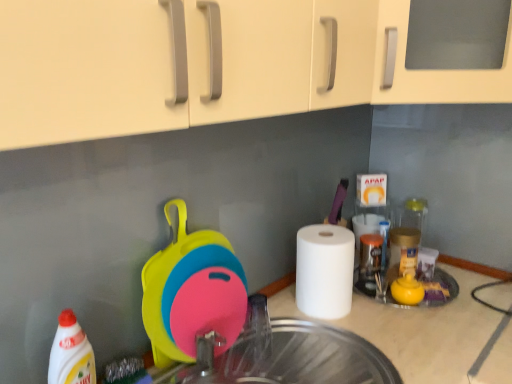
The image size is (512, 384). I want to click on white glossy bottle at lower left, so click(71, 353).

Measure the distance between silicone cutting board at center and camera.

The distance of silicone cutting board at center from camera is 37.70 inches.

Find the location of a particular element. transparent glass sink at center is located at coordinates (298, 359).

The image size is (512, 384). Identify the location of white glossy bottle at lower left. pos(71,353).

Can you tell me how much white matte paper towel at right and transparent glass sink at center differ in facing direction?

The angular difference between white matte paper towel at right and transparent glass sink at center is 1.01 degrees.

From the image's perspective, is white matte paper towel at right located above or below transparent glass sink at center?

Clearly, from the image's perspective, white matte paper towel at right is above transparent glass sink at center.

Is white matte paper towel at right not near transparent glass sink at center?

No, white matte paper towel at right is in close proximity to transparent glass sink at center.

Which is closer to the camera, (305, 313) or (305, 369)?

The point (305, 369) is closer to the camera.

In the scene shown: Is white matte paper towel at right taller than silicone cutting board at center?

Incorrect, the height of white matte paper towel at right is not larger of that of silicone cutting board at center.

Looking at this image, is the depth of white matte paper towel at right greater than that of silicone cutting board at center?

Yes, white matte paper towel at right is further from the viewer.

Can you confirm if white matte paper towel at right is smaller than silicone cutting board at center?

Yes.

How different are the orientations of silicone cutting board at center and white glossy bottle at lower left in degrees?

There is a 1.08-degree angle between the facing directions of silicone cutting board at center and white glossy bottle at lower left.

From the image's perspective, is silicone cutting board at center above or below white glossy bottle at lower left?

From the image's perspective, silicone cutting board at center appears above white glossy bottle at lower left.

Would you say white glossy bottle at lower left is part of silicone cutting board at center's contents?

No, white glossy bottle at lower left is located outside of silicone cutting board at center.

Is silicone cutting board at center at the left side of white glossy bottle at lower left?

Incorrect, silicone cutting board at center is not on the left side of white glossy bottle at lower left.

Does point (81, 378) come closer to viewer compared to point (324, 318)?

Yes, it is.

From the image's perspective, is white glossy bottle at lower left located beneath white matte paper towel at right?

Indeed, from the image's perspective, white glossy bottle at lower left is shown beneath white matte paper towel at right.

Considering the sizes of objects white glossy bottle at lower left and white matte paper towel at right in the image provided, who is taller, white glossy bottle at lower left or white matte paper towel at right?

white glossy bottle at lower left is taller.

Find the location of a particular element. paper towel behind the white glossy bottle at lower left is located at coordinates (324, 271).

Considering the relative sizes of metallic silver faucet at center and white glossy bottle at lower left in the image provided, is metallic silver faucet at center smaller than white glossy bottle at lower left?

Indeed, metallic silver faucet at center has a smaller size compared to white glossy bottle at lower left.

Does metallic silver faucet at center turn towards white glossy bottle at lower left?

No, metallic silver faucet at center does not turn towards white glossy bottle at lower left.

Find the location of a particular element. Image resolution: width=512 pixels, height=384 pixels. faucet lying above the white glossy bottle at lower left (from the image's perspective) is located at coordinates pyautogui.click(x=258, y=328).

Does metallic silver faucet at center have a lesser height compared to white glossy bottle at lower left?

Yes.

How distant is silicone cutting board at center from metallic silver faucet at center?

A distance of 7.31 inches exists between silicone cutting board at center and metallic silver faucet at center.

Looking at this image, can you tell me how much silicone cutting board at center and metallic silver faucet at center differ in facing direction?

The facing directions of silicone cutting board at center and metallic silver faucet at center are 0.0387 degrees apart.

Is silicone cutting board at center inside the boundaries of metallic silver faucet at center, or outside?

silicone cutting board at center is located beyond the bounds of metallic silver faucet at center.

In the scene shown: Is silicone cutting board at center in front of or behind metallic silver faucet at center in the image?

silicone cutting board at center is in front of metallic silver faucet at center.

At what (x,y) coordinates should I click in order to perform the action: click on cleaning product below the white matte paper towel at right (from the image's perspective). Please return your answer as a coordinate pair (x, y). This screenshot has width=512, height=384. Looking at the image, I should click on (71, 353).

Considering the positions of point (342, 231) and point (62, 340), is point (342, 231) closer or farther from the camera than point (62, 340)?

Point (342, 231) appears to be farther away from the viewer than point (62, 340).

From a real-world perspective, who is located higher, white matte paper towel at right or white glossy bottle at lower left?

From a 3D spatial view, white glossy bottle at lower left is above.

Which object is more forward, white matte paper towel at right or white glossy bottle at lower left?

white glossy bottle at lower left is more forward.

Where is `sink in front of the white matte paper towel at right`? sink in front of the white matte paper towel at right is located at coordinates [298, 359].

Where is `appliance on the left of white matte paper towel at right`? The image size is (512, 384). appliance on the left of white matte paper towel at right is located at coordinates (192, 292).

Considering their positions, is metallic silver faucet at center positioned closer to silicone cutting board at center than white matte paper towel at right?

metallic silver faucet at center is closer to silicone cutting board at center.

Estimate the real-world distances between objects in this image. Which object is further from white matte paper towel at right, white glossy bottle at lower left or transparent glass sink at center?

The object further to white matte paper towel at right is white glossy bottle at lower left.

Considering their positions, is transparent glass sink at center positioned closer to metallic silver faucet at center than silicone cutting board at center?

Among the two, transparent glass sink at center is located nearer to metallic silver faucet at center.

When comparing their distances from metallic silver faucet at center, does white glossy bottle at lower left or white matte paper towel at right seem closer?

white matte paper towel at right is closer to metallic silver faucet at center.

Considering their positions, is white matte paper towel at right positioned further to transparent glass sink at center than white glossy bottle at lower left?

Based on the image, white glossy bottle at lower left appears to be further to transparent glass sink at center.

Estimate the real-world distances between objects in this image. Which object is further from white glossy bottle at lower left, metallic silver faucet at center or white matte paper towel at right?

white matte paper towel at right lies further to white glossy bottle at lower left than the other object.

When comparing their distances from white matte paper towel at right, does silicone cutting board at center or white glossy bottle at lower left seem further?

white glossy bottle at lower left is positioned further to the anchor white matte paper towel at right.

Considering their positions, is white glossy bottle at lower left positioned further to transparent glass sink at center than silicone cutting board at center?

white glossy bottle at lower left.

Identify the location of appliance located between white glossy bottle at lower left and white matte paper towel at right in the left-right direction. (192, 292).

The height and width of the screenshot is (384, 512). Find the location of `appliance between white glossy bottle at lower left and metallic silver faucet at center`. appliance between white glossy bottle at lower left and metallic silver faucet at center is located at coordinates (192, 292).

At what (x,y) coordinates should I click in order to perform the action: click on faucet between silicone cutting board at center and white matte paper towel at right in the horizontal direction. Please return your answer as a coordinate pair (x, y). Looking at the image, I should click on (258, 328).

Where is `appliance located between transparent glass sink at center and metallic silver faucet at center in the depth direction`? appliance located between transparent glass sink at center and metallic silver faucet at center in the depth direction is located at coordinates (192, 292).